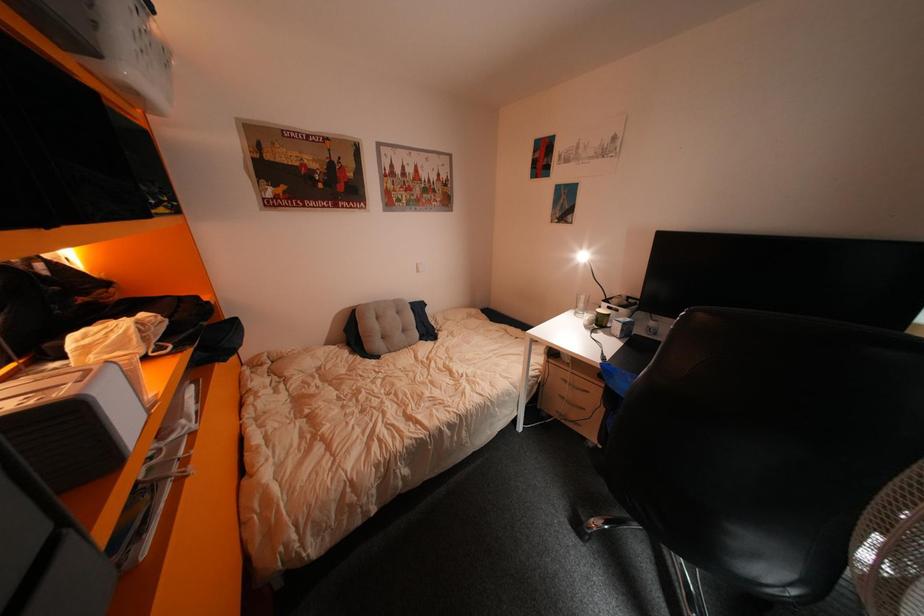
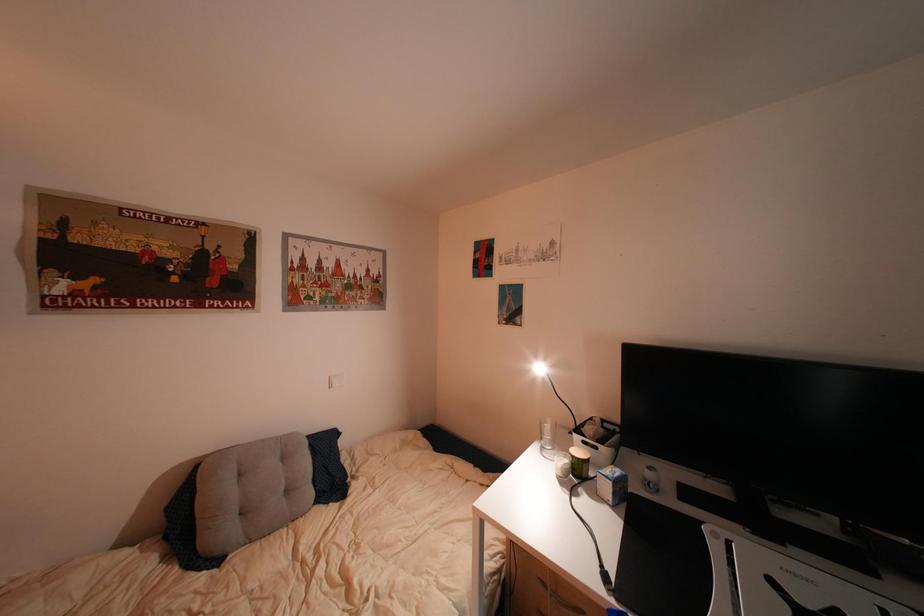
Which direction would the cameraman need to move to produce the second image?

The cameraman moved toward right, forward.